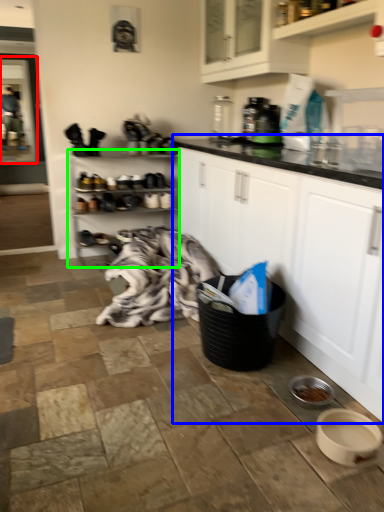
Question: Considering the real-world distances, which object is closest to screen door (highlighted by a red box)? cabinetry (highlighted by a blue box) or shelf (highlighted by a green box).

Choices:
 (A) cabinetry
 (B) shelf

Answer: (B)